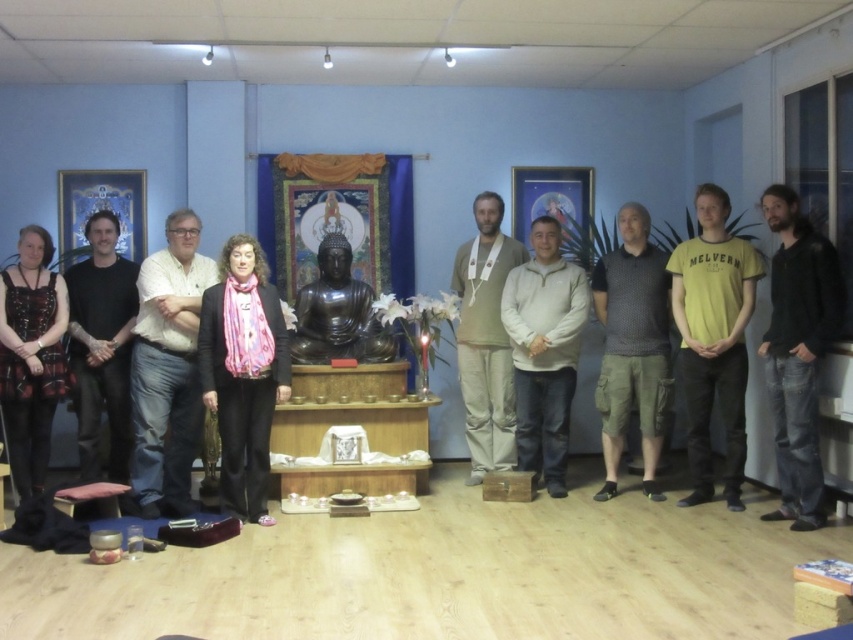
Question: Which is farther from the black leather jacket at right?

Choices:
 (A) dark gray textured shirt at center
 (B) black matte shirt at left

Answer: (B)

Question: Is black leather jacket at right thinner than white fleece jacket at center?

Choices:
 (A) yes
 (B) no

Answer: (A)

Question: Estimate the real-world distances between objects in this image. Which object is closer to the beige cotton pants at center?

Choices:
 (A) black matte shirt at left
 (B) black polished wood statue at center

Answer: (B)

Question: Which of the following is the farthest from the observer?

Choices:
 (A) white shirt at center
 (B) white fleece jacket at center
 (C) yellow matte t-shirt at right

Answer: (B)

Question: Considering the relative positions of yellow matte t-shirt at right and dark gray textured shirt at center in the image provided, where is yellow matte t-shirt at right located with respect to dark gray textured shirt at center?

Choices:
 (A) left
 (B) right

Answer: (B)

Question: Does black leather jacket at right lie in front of white fleece jacket at center?

Choices:
 (A) yes
 (B) no

Answer: (A)